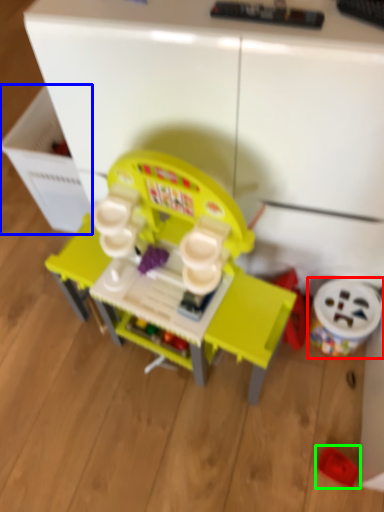
Question: Which is farther away from toy (highlighted by a red box)? drawer (highlighted by a blue box) or toy (highlighted by a green box)?

Choices:
 (A) drawer
 (B) toy

Answer: (A)